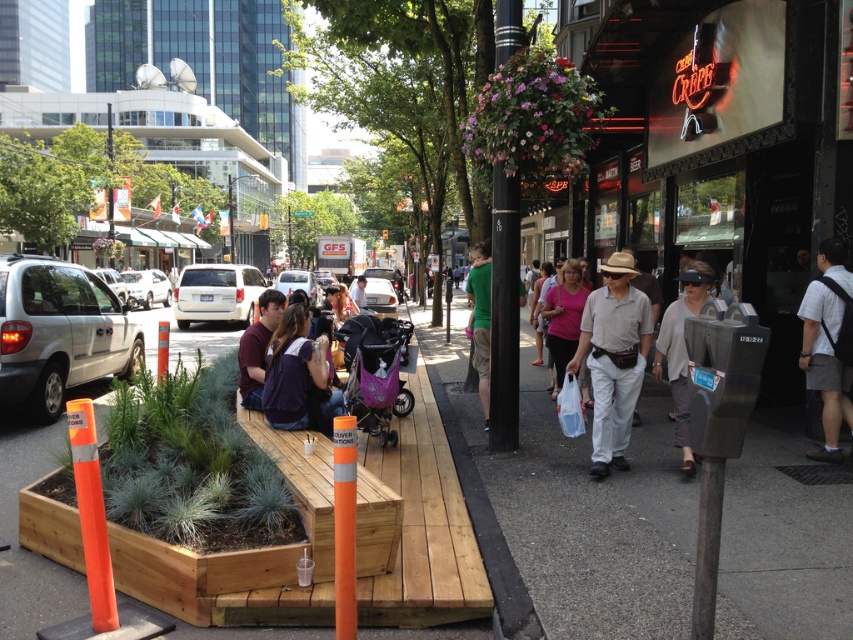
You are a photographer trying to capture a candid shot of two people sitting on a wooden platform. You notice the light brown cotton shirt at center and the matte maroon shirt at center. Which shirt should you focus on if you want to include both in the frame without moving your camera? Explain your reasoning based on their positions.

The light brown cotton shirt at center is positioned on the right side of the matte maroon shirt at center. To include both in the frame without moving the camera, focus on the matte maroon shirt at center first, as it is on the left, allowing the light brown cotton shirt at center to naturally fall into the right side of the frame.

You are a delivery person carrying a heavy box and need to place it on the gray concrete sidewalk at center. However, you also see the purple fabric shirt at center nearby. Since the sidewalk is higher than the shirt, will you be able to safely place the box on the sidewalk without it sliding off?

The gray concrete sidewalk at center is higher than the purple fabric shirt at center, so placing the box on the sidewalk should be stable as the shirt is lower and not an obstruction.